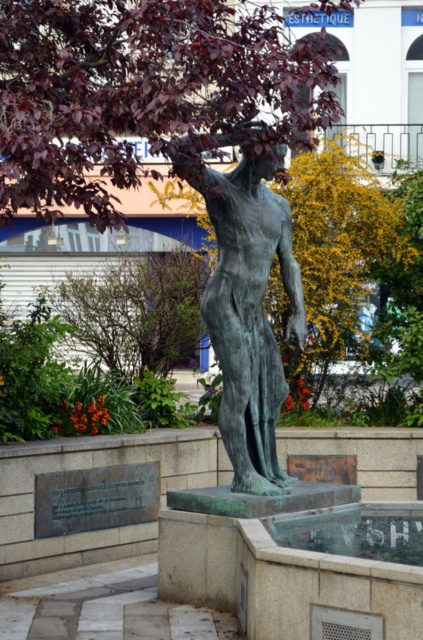
You are a landscape architect designing a new public space. You have to place a new bench between the dark red leafy tree at upper left and the bronze statue at center. Which object should the bench be closer to if you want it to be near the larger object?

The bronze statue at center is larger than the dark red leafy tree at upper left, so the bench should be placed closer to the bronze statue at center.

You are a photographer planning to take a picture of the bronze statue at center. You want to ensure that the dark red leafy tree at upper left does not block the view of the statue. Based on the scene description, is the tree positioned in a way that it might obstruct the statue in your photo?

The dark red leafy tree at upper left is above the bronze statue at center, so it might block the view of the statue in your photo.